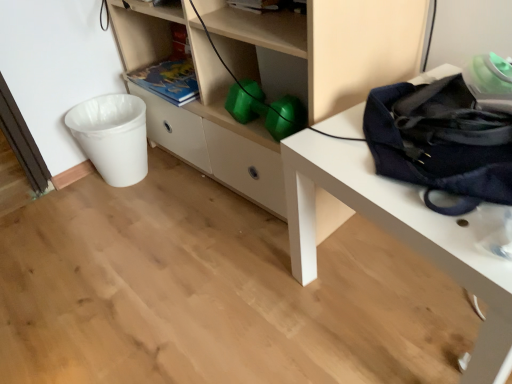
Question: Relative to navy blue fabric messenger bag at right, is navy blue fabric bag at right in front or behind?

Choices:
 (A) behind
 (B) front

Answer: (B)

Question: From a real-world perspective, is navy blue fabric bag at right positioned above or below navy blue fabric messenger bag at right?

Choices:
 (A) above
 (B) below

Answer: (B)

Question: Which is farther from the navy blue fabric messenger bag at right?

Choices:
 (A) white plastic trash can at left
 (B) matte green book at center
 (C) navy blue fabric bag at right
 (D) matte white shelf at center

Answer: (A)

Question: Estimate the real-world distances between objects in this image. Which object is closer to the navy blue fabric messenger bag at right?

Choices:
 (A) navy blue fabric bag at right
 (B) white plastic trash can at left
 (C) matte green book at center
 (D) matte white shelf at center

Answer: (A)